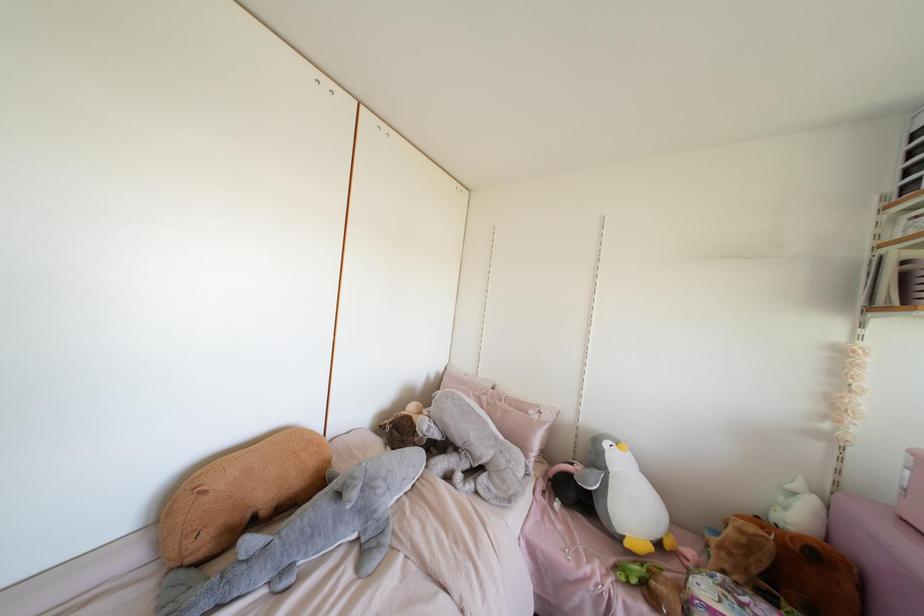
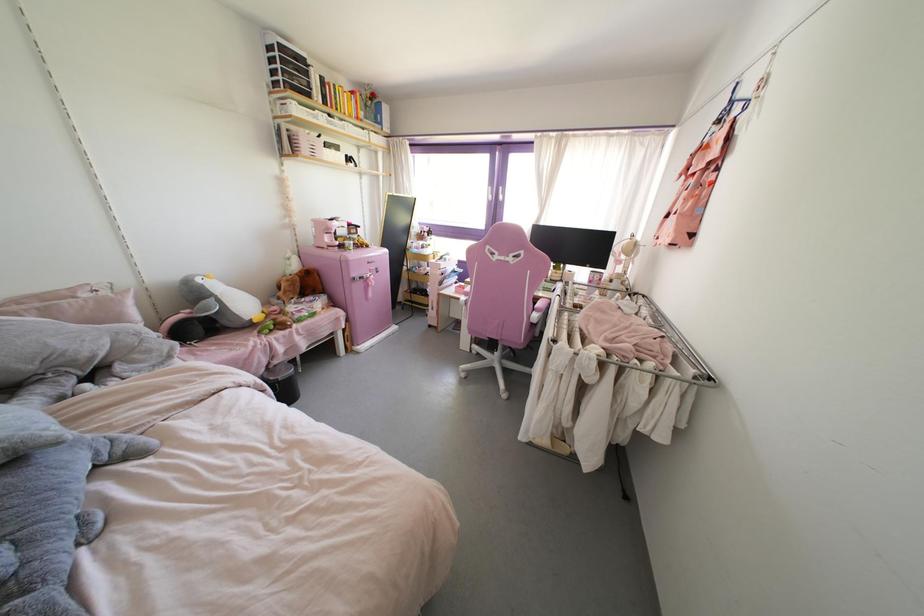
Based on the continuous images, in which direction is the camera rotating?

The camera's rotation is toward right-down.